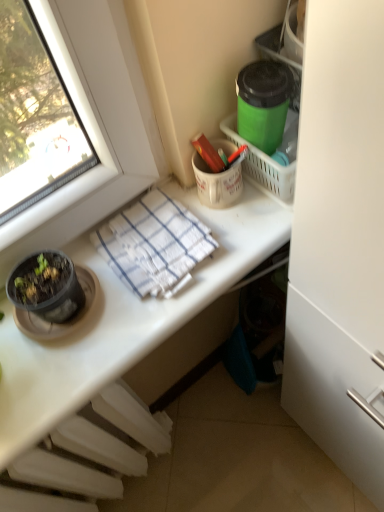
Question: Considering the relative sizes of white plastic radiator at lower left and white woven towel at center in the image provided, is white plastic radiator at lower left bigger than white woven towel at center?

Choices:
 (A) yes
 (B) no

Answer: (A)

Question: Is white plastic radiator at lower left taller than white woven towel at center?

Choices:
 (A) no
 (B) yes

Answer: (B)

Question: Does white plastic radiator at lower left have a greater width compared to white woven towel at center?

Choices:
 (A) no
 (B) yes

Answer: (A)

Question: Considering the relative sizes of white plastic radiator at lower left and white woven towel at center in the image provided, is white plastic radiator at lower left thinner than white woven towel at center?

Choices:
 (A) yes
 (B) no

Answer: (A)

Question: Is white plastic radiator at lower left in front of white woven towel at center?

Choices:
 (A) no
 (B) yes

Answer: (B)

Question: Considering their positions, is white woven towel at center located in front of or behind green matte container at upper right?

Choices:
 (A) behind
 (B) front

Answer: (A)

Question: Considering the positions of white woven towel at center and green matte container at upper right in the image, is white woven towel at center taller or shorter than green matte container at upper right?

Choices:
 (A) tall
 (B) short

Answer: (B)

Question: From the image's perspective, is white woven towel at center positioned above or below green matte container at upper right?

Choices:
 (A) below
 (B) above

Answer: (A)

Question: Is white woven towel at center wider or thinner than green matte container at upper right?

Choices:
 (A) wide
 (B) thin

Answer: (A)

Question: From a real-world perspective, is white glossy desk at upper center above or below white woven towel at center?

Choices:
 (A) above
 (B) below

Answer: (B)

Question: Relative to white woven towel at center, is white glossy desk at upper center in front or behind?

Choices:
 (A) front
 (B) behind

Answer: (A)

Question: Considering the positions of white glossy desk at upper center and white woven towel at center in the image, is white glossy desk at upper center wider or thinner than white woven towel at center?

Choices:
 (A) thin
 (B) wide

Answer: (B)

Question: From the image's perspective, relative to white woven towel at center, is white glossy desk at upper center above or below?

Choices:
 (A) below
 (B) above

Answer: (A)

Question: Does point (158, 240) appear closer or farther from the camera than point (127, 344)?

Choices:
 (A) farther
 (B) closer

Answer: (A)

Question: Considering their positions, is white woven towel at center located in front of or behind white glossy desk at upper center?

Choices:
 (A) behind
 (B) front

Answer: (A)